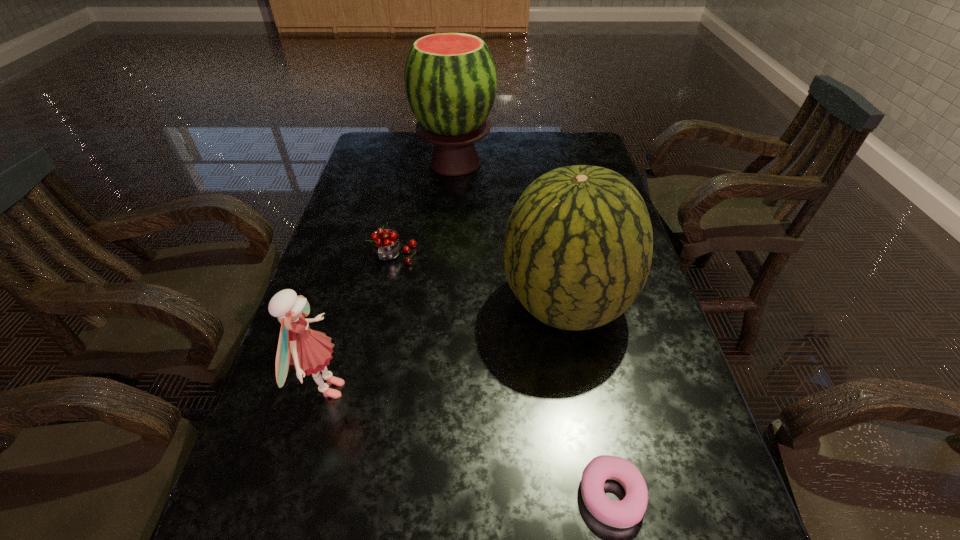
The width and height of the screenshot is (960, 540). What are the coordinates of `vacant area between the pastry and the cherry` in the screenshot? It's located at pyautogui.click(x=503, y=376).

I want to click on vacant space that's between the shortest object and the cherry, so click(x=503, y=376).

At what (x,y) coordinates should I click in order to perform the action: click on free spot between the farther watermelon and the doll. Please return your answer as a coordinate pair (x, y). Looking at the image, I should click on (391, 276).

Find the location of a particular element. object that is the second closest to the pastry is located at coordinates (309, 351).

Where is `object that is the fourth closest to the farther watermelon`? object that is the fourth closest to the farther watermelon is located at coordinates (626, 513).

Where is `free location that satisfies the following two spatial constraints: 1. on the back side of the pastry; 2. on the front-facing side of the doll`? free location that satisfies the following two spatial constraints: 1. on the back side of the pastry; 2. on the front-facing side of the doll is located at coordinates (590, 389).

What are the coordinates of `blank area in the image that satisfies the following two spatial constraints: 1. on the handle side of the nearer watermelon; 2. on the right side of the second shortest object` in the screenshot? It's located at (384, 305).